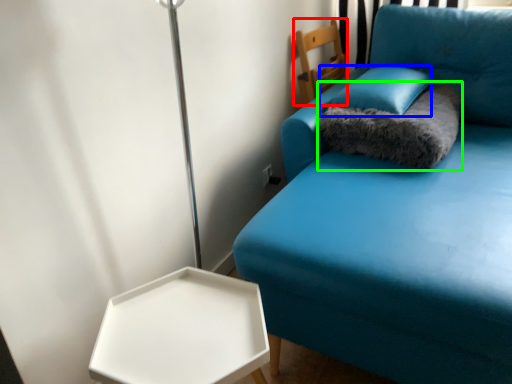
Question: Which is nearer to the furniture (highlighted by a red box)? pillow (highlighted by a blue box) or cat bed (highlighted by a green box).

Choices:
 (A) pillow
 (B) cat bed

Answer: (A)